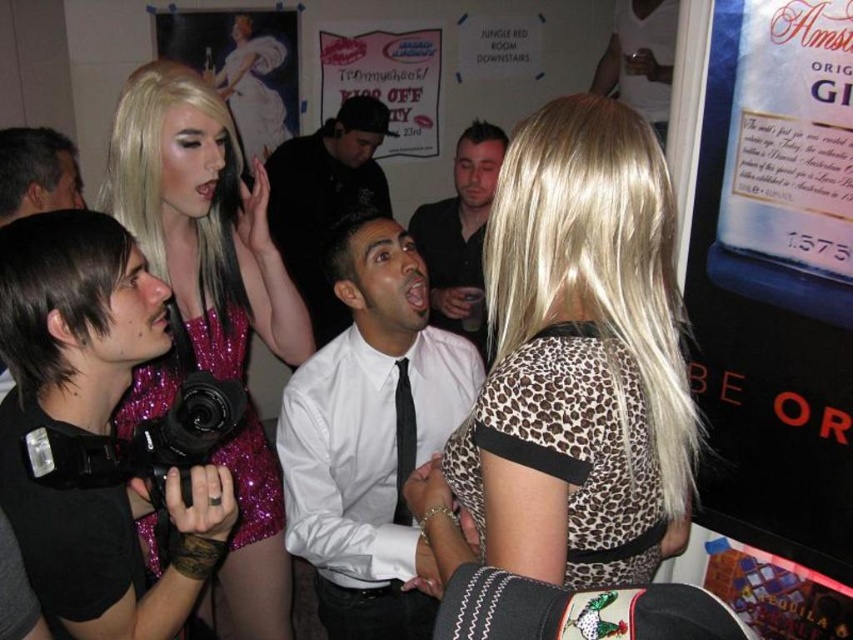
Between matte gold glass at upper right and black silk tie at center, which one is positioned higher?

matte gold glass at upper right is above.

Measure the distance between matte gold glass at upper right and camera.

They are 4.50 feet apart.

Who is more distant from viewer, (734, 120) or (401, 403)?

The point (401, 403) is behind.

Find the location of a particular element. matte gold glass at upper right is located at coordinates (791, 136).

Is black plastic video camera at lower left shorter than black silk tie at center?

Correct, black plastic video camera at lower left is not as tall as black silk tie at center.

Is black plastic video camera at lower left further to camera compared to black silk tie at center?

No, black plastic video camera at lower left is in front of black silk tie at center.

Between point (206, 426) and point (401, 440), which one is positioned behind?

The point (401, 440) is behind.

This screenshot has height=640, width=853. I want to click on black plastic video camera at lower left, so click(143, 442).

Which is above, white shirt at center or black plastic video camera at lower left?

white shirt at center

Is white shirt at center below black plastic video camera at lower left?

No.

Identify the location of white shirt at center. This screenshot has width=853, height=640. (325, 198).